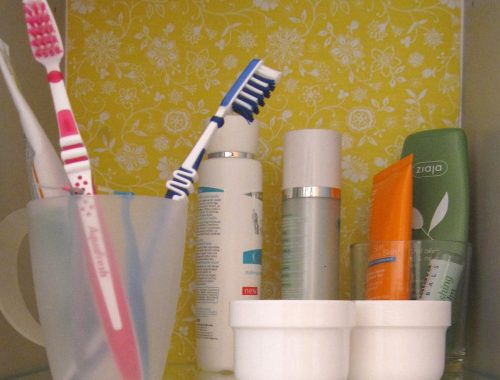
Find the location of a particular element. This screenshot has width=500, height=380. 1 handle is located at coordinates (14, 313).